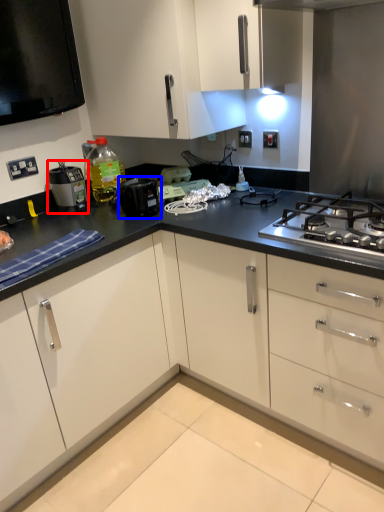
Question: Which object appears farthest to the camera in this image, home appliance (highlighted by a red box) or kitchen appliance (highlighted by a blue box)?

Choices:
 (A) home appliance
 (B) kitchen appliance

Answer: (A)